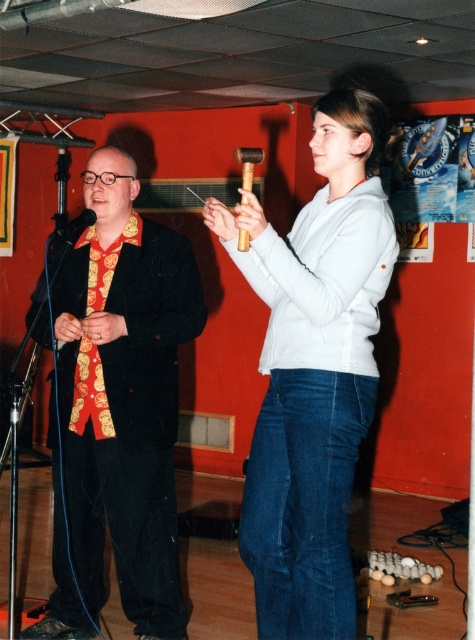
Is gold printed silk tie at left smaller than black matte microphone at left?

No.

Does gold printed silk tie at left come behind black matte microphone at left?

That is True.

Does point (120, 241) lie in front of point (53, 234)?

Yes, point (120, 241) is closer to viewer.

Where is `gold printed silk tie at left`? This screenshot has height=640, width=475. gold printed silk tie at left is located at coordinates (89, 392).

Which is more to the left, white matte sweater at center or matte black suit at left?

matte black suit at left

From the picture: Does white matte sweater at center appear over matte black suit at left?

Yes, white matte sweater at center is above matte black suit at left.

Is point (274, 353) positioned behind point (148, 280)?

No.

Locate an element on the screen. The width and height of the screenshot is (475, 640). white matte sweater at center is located at coordinates (313, 371).

Who is more distant from viewer, (333, 534) or (104, 401)?

The point (104, 401) is more distant.

Describe the element at coordinates (313, 371) in the screenshot. I see `white matte sweater at center` at that location.

Between point (297, 554) and point (92, 340), which one is positioned in front?

Positioned in front is point (297, 554).

At what (x,y) coordinates should I click in order to perform the action: click on white matte sweater at center. Please return your answer as a coordinate pair (x, y). Looking at the image, I should click on (313, 371).